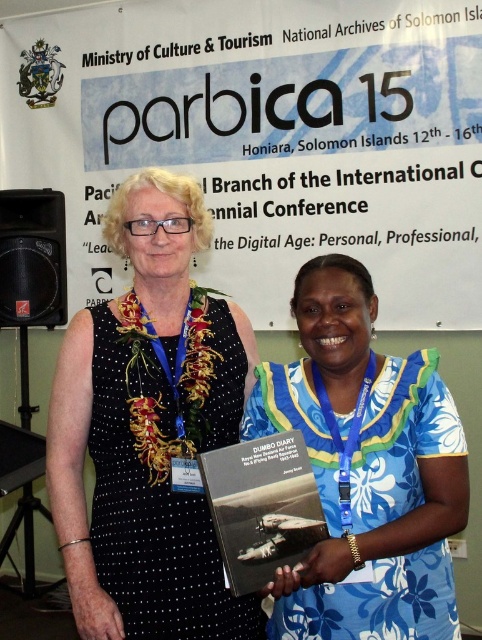
You are organizing a conference and need to place a large poster on the wall. The poster is the size of the blue floral dress at center. Will it fit next to the black plastic speaker at left?

The blue floral dress at center is bigger than the black plastic speaker at left, so the poster will not fit next to the black plastic speaker at left since it is larger in size.

What are the coordinates of the black dotted dress at left in the image?

The coordinates of the black dotted dress at left are at point (148, 429).

What is the exact location of the blue floral dress at center in the image?

The blue floral dress at center is located at point (365, 468).